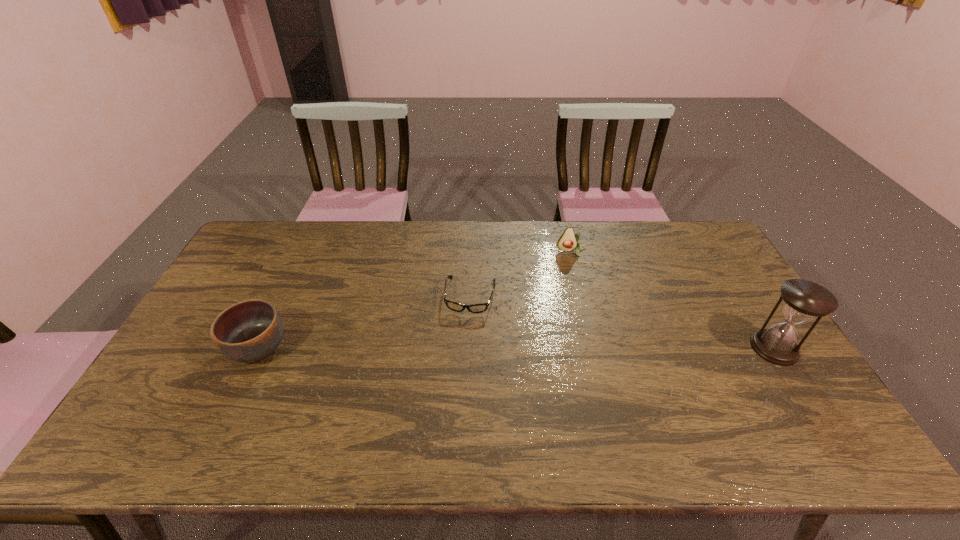
I want to click on free space at the right edge of the desktop, so click(x=711, y=319).

Where is `vacant space at the near left corner of the desktop`? This screenshot has height=540, width=960. vacant space at the near left corner of the desktop is located at coordinates (149, 394).

Find the location of a particular element. The height and width of the screenshot is (540, 960). blank space at the far right corner of the desktop is located at coordinates (693, 221).

What are the coordinates of `unoccupied area between the third object from left to right and the spectacles` in the screenshot? It's located at [x=521, y=274].

Image resolution: width=960 pixels, height=540 pixels. In order to click on empty space between the second object from right to left and the bowl in this screenshot , I will do `click(415, 300)`.

Find the location of `free point between the spectacles and the bowl`. free point between the spectacles and the bowl is located at coordinates [365, 322].

At what (x,y) coordinates should I click in order to perform the action: click on free space between the third object from right to left and the bowl. Please return your answer as a coordinate pair (x, y). This screenshot has height=540, width=960. Looking at the image, I should click on (365, 322).

Find the location of a particular element. vacant space that's between the third object from right to left and the farthest object is located at coordinates (521, 274).

Where is `vacant space that's between the avocado and the third nearest object`? Image resolution: width=960 pixels, height=540 pixels. vacant space that's between the avocado and the third nearest object is located at coordinates (521, 274).

At what (x,y) coordinates should I click in order to perform the action: click on free space between the bowl and the farthest object. Please return your answer as a coordinate pair (x, y). Looking at the image, I should click on (415, 300).